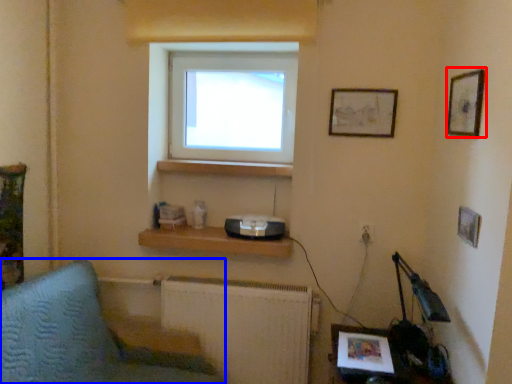
Question: Among these objects, which one is nearest to the camera, picture frame (highlighted by a red box) or furniture (highlighted by a blue box)?

Choices:
 (A) picture frame
 (B) furniture

Answer: (B)